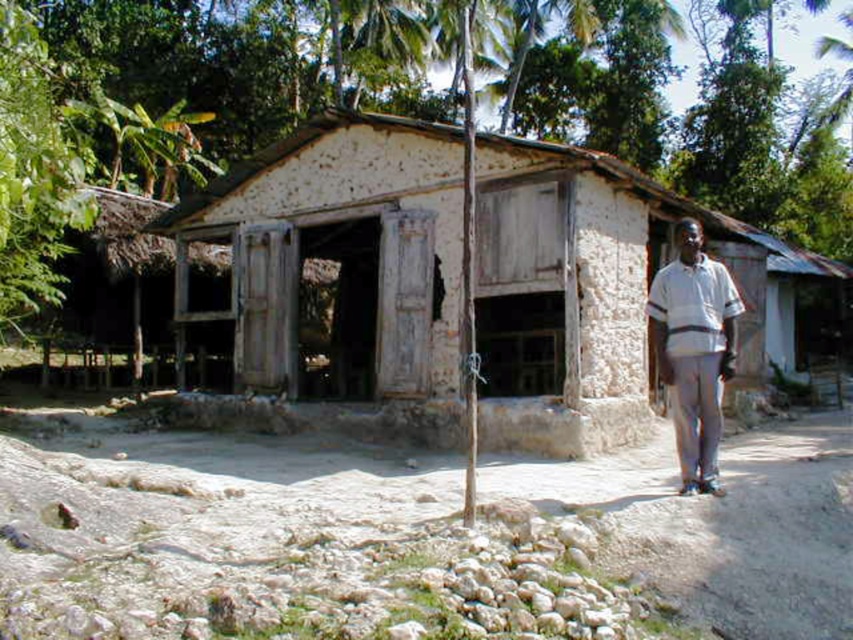
You are standing in front of the traditional house and want to determine the spatial relationship between two points marked in the image. Which point is closer to you, point 1 at coordinates point 1 at coordinates point (167,541) or point (807,257)?

Point (167,541) is closer to the viewer than point (807,257).

Looking at this image, you are standing at the entrance of the traditional house and want to find the brown dirt track at lower center. According to the coordinates provided, in which direction should you walk to reach it?

The brown dirt track at lower center is located at coordinates point [407,534]. Since the coordinates are given as x and y values between 0 and 1, with [0,0] being the bottom left corner, you should walk towards the right and slightly upwards from the entrance to reach the brown dirt track at lower center.

You are standing in front of the house and want to walk to the white striped shirt at right. Which path should you take, the brown dirt track at lower center or another path?

The brown dirt track at lower center is closer to the viewer than the white striped shirt at right, so you should take the brown dirt track at lower center to reach the shirt more quickly.